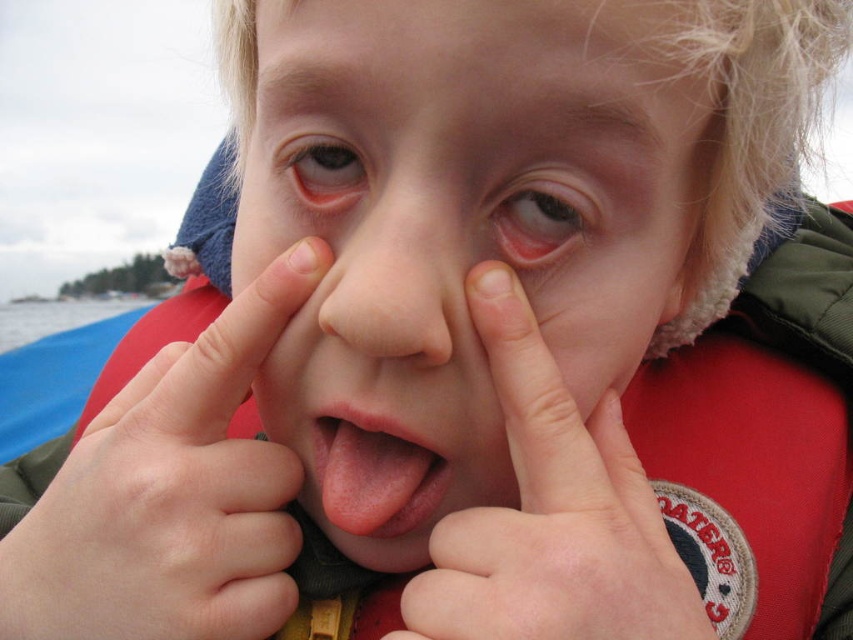
Between point (397, 340) and point (456, 333), which one is positioned behind?

The point (456, 333) is behind.

Who is positioned more to the right, smooth skin face at center or smooth flesh-colored nose at center?

Positioned to the right is smooth skin face at center.

Who is more distant from viewer, (335, 326) or (329, 284)?

Positioned behind is point (329, 284).

This screenshot has width=853, height=640. Identify the location of smooth skin face at center. (456, 234).

How distant is red fabric life jacket at center from pink flesh at center?

3.42 inches

Describe the element at coordinates (164, 496) in the screenshot. I see `red fabric life jacket at center` at that location.

Find the location of `red fabric life jacket at center`. red fabric life jacket at center is located at coordinates (164, 496).

Between smooth skin hand at center and pink flesh at center, which one appears on the left side from the viewer's perspective?

Positioned to the left is smooth skin hand at center.

Between smooth skin hand at center and pink flesh at center, which one appears on the right side from the viewer's perspective?

pink flesh at center is more to the right.

Does point (175, 602) come in front of point (592, 483)?

No.

Locate an element on the screen. The height and width of the screenshot is (640, 853). smooth skin hand at center is located at coordinates (170, 496).